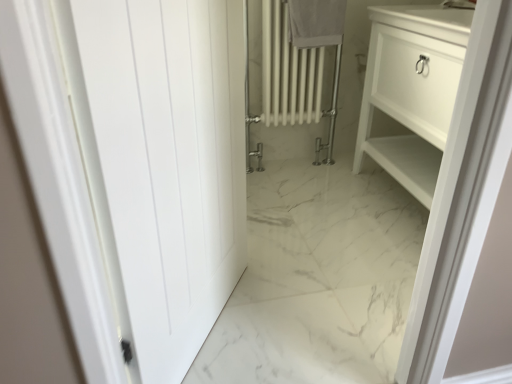
Question: Is point (323, 43) closer or farther from the camera than point (168, 69)?

Choices:
 (A) farther
 (B) closer

Answer: (A)

Question: From a real-world perspective, is white cotton towel at upper center positioned above or below white matte door at left?

Choices:
 (A) above
 (B) below

Answer: (A)

Question: Estimate the real-world distances between objects in this image. Which object is farther from the white matte door at left?

Choices:
 (A) white glossy cabinet at right
 (B) white cotton towel at upper center

Answer: (B)

Question: Which is nearer to the white matte door at left?

Choices:
 (A) white glossy cabinet at right
 (B) white cotton towel at upper center

Answer: (A)